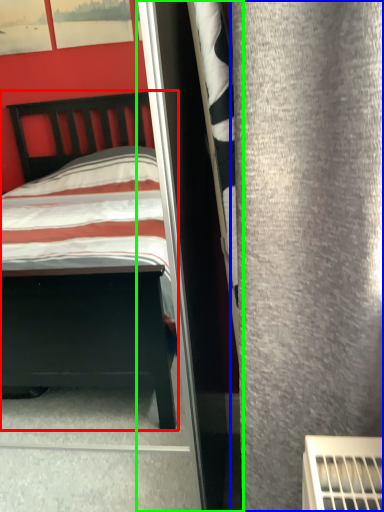
Question: Considering the real-world distances, which object is closest to bed (highlighted by a red box)? curtain (highlighted by a blue box) or screen door (highlighted by a green box).

Choices:
 (A) curtain
 (B) screen door

Answer: (B)